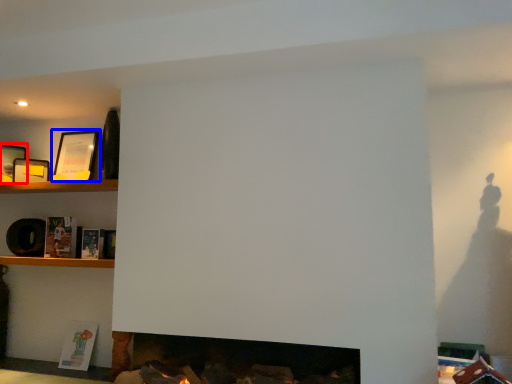
Question: Which object is closer to the camera taking this photo, picture frame (highlighted by a red box) or picture frame (highlighted by a blue box)?

Choices:
 (A) picture frame
 (B) picture frame

Answer: (A)